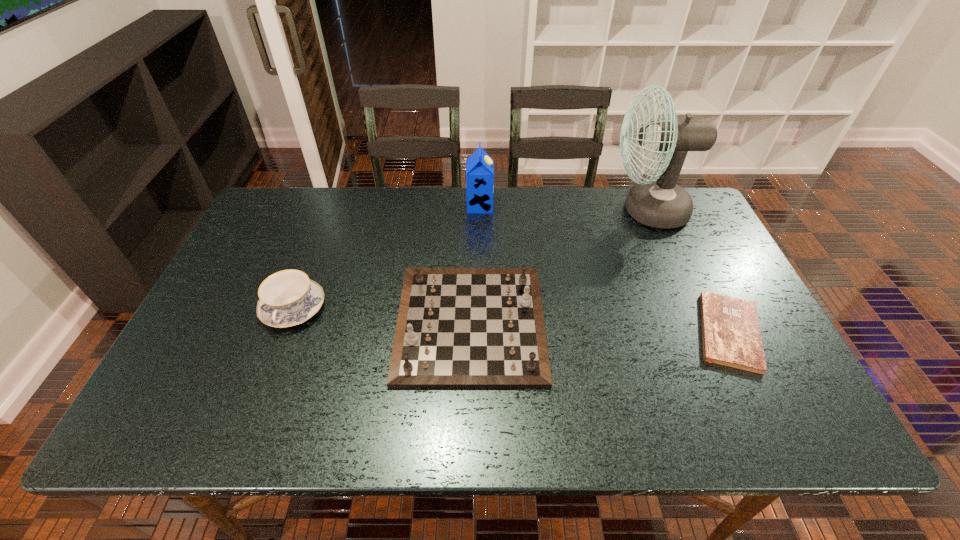
What are the coordinates of `free space at the left edge of the desktop` in the screenshot? It's located at (279, 242).

The image size is (960, 540). I want to click on free location at the far left corner, so click(307, 202).

Locate an element on the screen. The width and height of the screenshot is (960, 540). vacant area at the near left corner is located at coordinates point(182,407).

What are the coordinates of `free location at the near right corner` in the screenshot? It's located at (804, 406).

This screenshot has width=960, height=540. In order to click on free space that is in between the chessboard and the Bible in this screenshot , I will do `click(600, 328)`.

Locate an element on the screen. unoccupied area between the fan and the chessboard is located at coordinates (559, 267).

The width and height of the screenshot is (960, 540). What are the coordinates of `free space between the carton and the tallest object` in the screenshot? It's located at (564, 208).

The height and width of the screenshot is (540, 960). I want to click on vacant point located between the chessboard and the second tallest object, so click(475, 265).

Identify the location of free spot between the second tallest object and the shortest object. (605, 269).

I want to click on vacant area that lies between the chessboard and the tallest object, so click(559, 267).